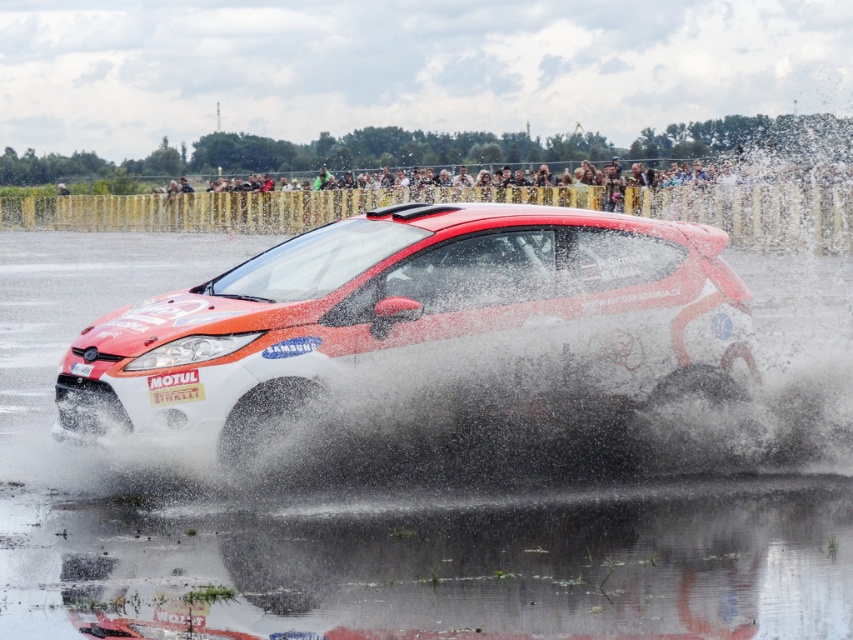
Is shiny white car at center positioned at the back of black rubber tire at center?

No, it is in front of black rubber tire at center.

Who is positioned more to the right, shiny white car at center or black rubber tire at center?

shiny white car at center

The height and width of the screenshot is (640, 853). I want to click on shiny white car at center, so click(x=416, y=328).